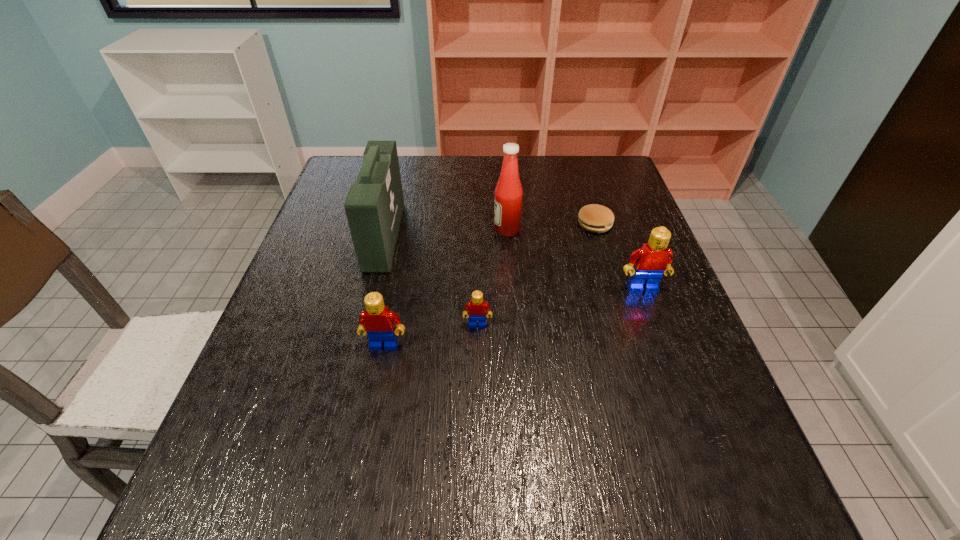
Identify the location of the leftmost Lego. Image resolution: width=960 pixels, height=540 pixels. (377, 321).

The width and height of the screenshot is (960, 540). Find the location of `the third shortest object`. the third shortest object is located at coordinates (377, 321).

You are a GUI agent. You are given a task and a screenshot of the screen. Output one action in this format:
    pyautogui.click(x=<x>, y=<y>)
    Task: Click on the second shortest object
    The width and height of the screenshot is (960, 540).
    Given the screenshot: What is the action you would take?
    pyautogui.click(x=477, y=308)

The height and width of the screenshot is (540, 960). What are the coordinates of `the second farthest Lego` in the screenshot? It's located at (477, 308).

This screenshot has height=540, width=960. What are the coordinates of `the farthest Lego` in the screenshot? It's located at (651, 261).

Locate an element on the screen. the rightmost Lego is located at coordinates (651, 261).

This screenshot has width=960, height=540. Identify the location of the first-aid kit. (374, 205).

Identify the location of patty. (595, 218).

Locate an element on the screen. This screenshot has height=540, width=960. condiment is located at coordinates (508, 194).

Image resolution: width=960 pixels, height=540 pixels. I want to click on vacant space located on the front-facing side of the nearest Lego, so click(366, 442).